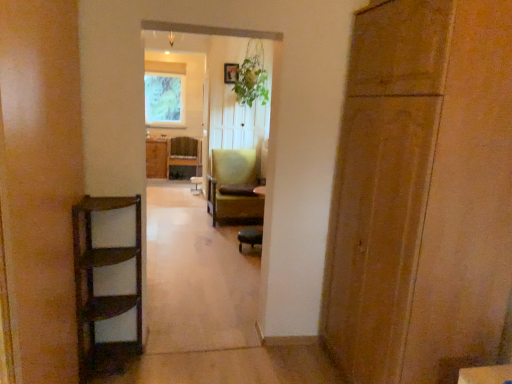
Question: Is green fabric chair at center, positioned as the 2th chair in front-to-back order, oriented away from matte black chair at center, which is the 1th chair from front to back?

Choices:
 (A) yes
 (B) no

Answer: (B)

Question: Is green fabric chair at center, the 2th chair from the right, positioned before matte black chair at center, the third chair viewed from the left?

Choices:
 (A) yes
 (B) no

Answer: (B)

Question: Considering the relative positions of green fabric chair at center, which is the second chair from back to front, and matte black chair at center, the third chair viewed from the left, in the image provided, is green fabric chair at center, which is the second chair from back to front, behind matte black chair at center, the third chair viewed from the left,?

Choices:
 (A) yes
 (B) no

Answer: (A)

Question: Are green fabric chair at center, the 2th chair from the right, and matte black chair at center, the third chair viewed from the left, far apart?

Choices:
 (A) yes
 (B) no

Answer: (B)

Question: Can you confirm if green fabric chair at center, which is the second chair in left-to-right order, is bigger than matte black chair at center, acting as the 3th chair starting from the back?

Choices:
 (A) no
 (B) yes

Answer: (B)

Question: Is green fabric chair at center, the 2th chair from the right, taller than matte black chair at center, which is the 1th chair from front to back?

Choices:
 (A) yes
 (B) no

Answer: (A)

Question: Can you confirm if green leafy plant at center is positioned to the right of green textured fabric at upper center?

Choices:
 (A) yes
 (B) no

Answer: (A)

Question: Can you confirm if green leafy plant at center is thinner than green textured fabric at upper center?

Choices:
 (A) no
 (B) yes

Answer: (A)

Question: Is green leafy plant at center not close to green textured fabric at upper center?

Choices:
 (A) yes
 (B) no

Answer: (A)

Question: From the image's perspective, is green leafy plant at center on green textured fabric at upper center?

Choices:
 (A) no
 (B) yes

Answer: (A)

Question: From a real-world perspective, does green leafy plant at center stand above green textured fabric at upper center?

Choices:
 (A) no
 (B) yes

Answer: (B)

Question: From the image's perspective, is green leafy plant at center located beneath green textured fabric at upper center?

Choices:
 (A) yes
 (B) no

Answer: (A)

Question: From a real-world perspective, is wooden chair at center, acting as the third chair starting from the front, over green fabric chair at center, positioned as the 2th chair in front-to-back order?

Choices:
 (A) no
 (B) yes

Answer: (A)